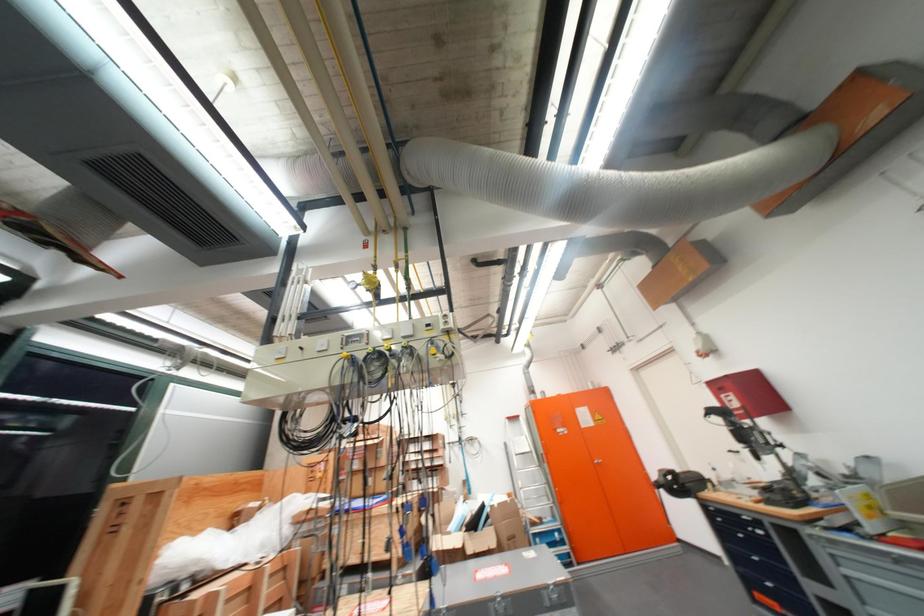
The image size is (924, 616). What are the coordinates of `chair armrest` in the screenshot? It's located at (681, 483).